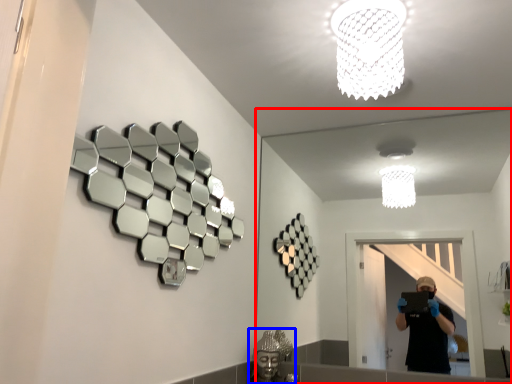
Question: Which object is further to the camera taking this photo, mirror (highlighted by a red box) or reflection (highlighted by a blue box)?

Choices:
 (A) mirror
 (B) reflection

Answer: (B)